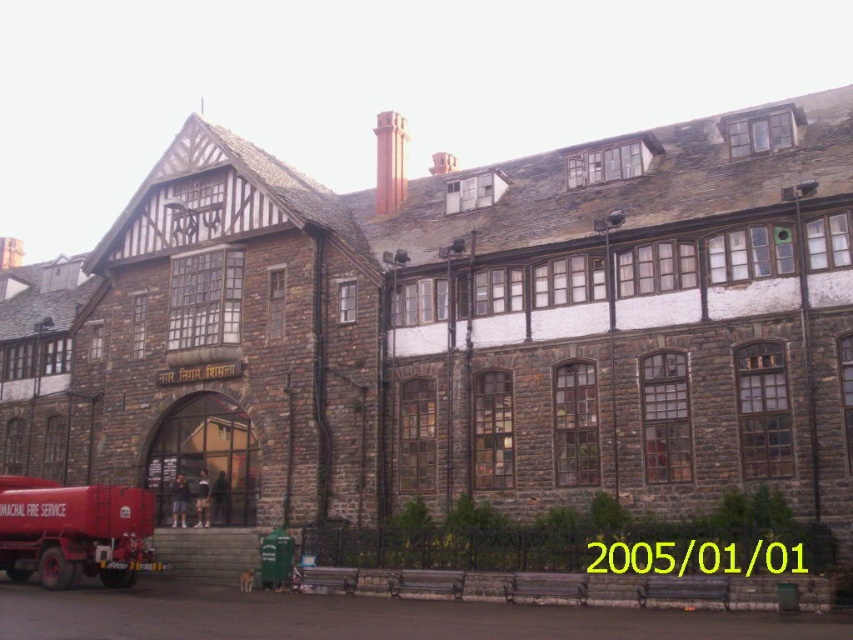
Between point (77, 486) and point (378, 134), which one is positioned in front?

Point (77, 486) is more forward.

This screenshot has width=853, height=640. In order to click on matte red truck at lower left in this screenshot , I will do `click(74, 531)`.